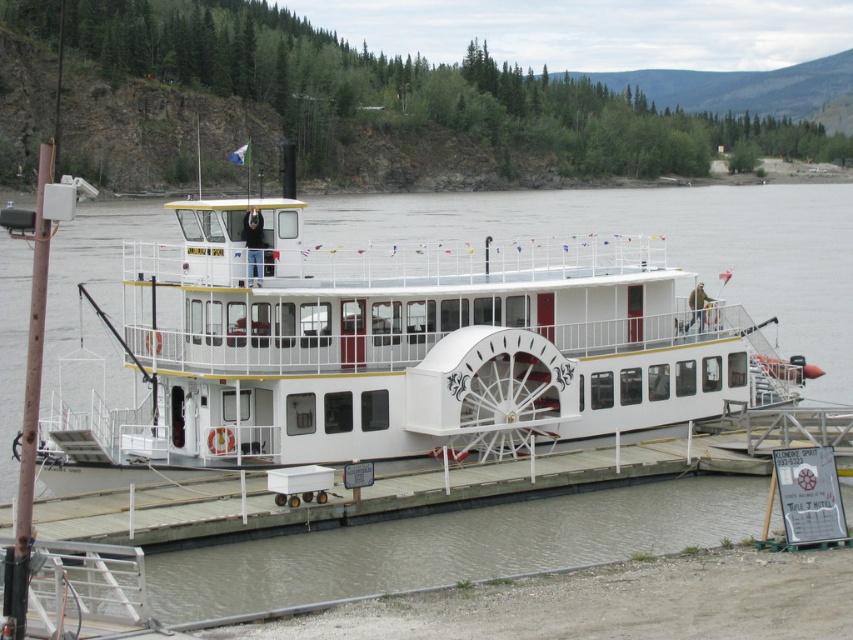
Question: Among these points, which one is nearest to the camera?

Choices:
 (A) (401, 433)
 (B) (509, 484)

Answer: (B)

Question: Does white matte paddlewheel boat at center appear on the left side of white wooden dock at center?

Choices:
 (A) no
 (B) yes

Answer: (B)

Question: In this image, where is white matte paddlewheel boat at center located relative to white wooden dock at center?

Choices:
 (A) below
 (B) above

Answer: (B)

Question: Which point is farther to the camera?

Choices:
 (A) white matte paddlewheel boat at center
 (B) white wooden dock at center

Answer: (B)

Question: In this image, where is white matte paddlewheel boat at center located relative to white wooden dock at center?

Choices:
 (A) below
 (B) above

Answer: (B)